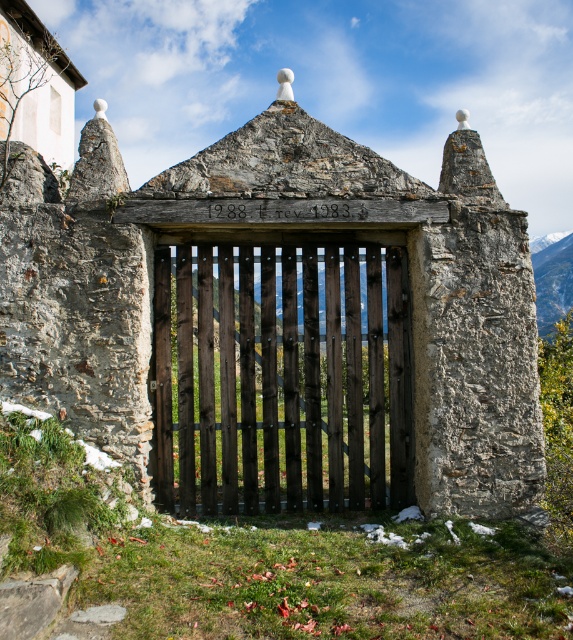
You are standing at the camera position looking at the rustic stone gate. There is a point marked at coordinates point (x=296, y=384). Can you reach that point without moving your feet?

The point (x=296, y=384) is 7.55 meters away from the camera, so yes, you can reach it without moving your feet if you have a reach of at least 7.55 meters. However, typical human reach is much shorter, so realistically you would need to move closer.

From the picture: You are a visitor approaching the rustic stone gate. You see the dark wood gate at center and the smooth gray rock at upper right. Which object is located more to the left side?

The dark wood gate at center is positioned on the left side of smooth gray rock at upper right, so it is more to the left.

You are a painter who wants to paint the dark wood gate at center and the smooth gray rock at upper right. Since you need to know which object is taller, can you tell me which one is taller?

The dark wood gate at center is not as tall as smooth gray rock at upper right, so the smooth gray rock at upper right is taller.